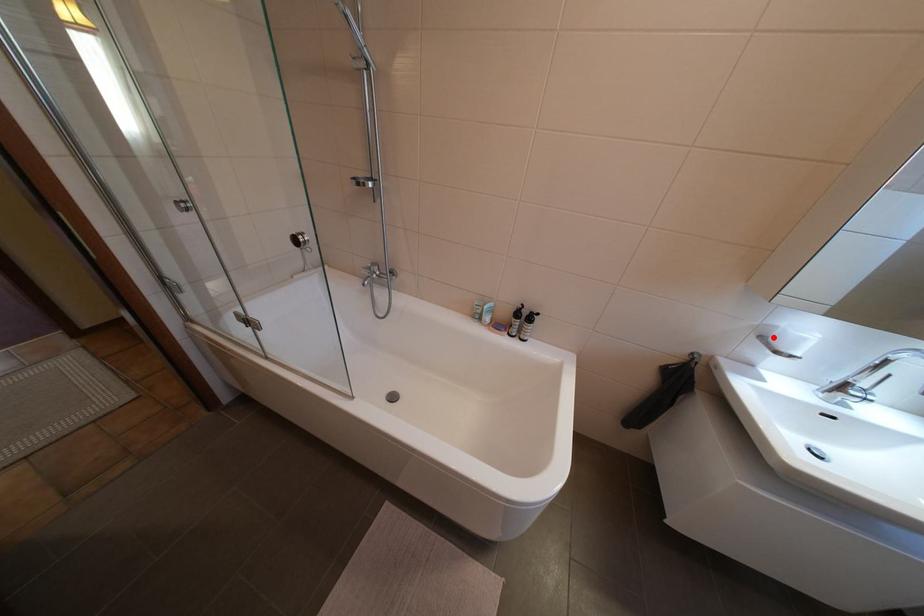
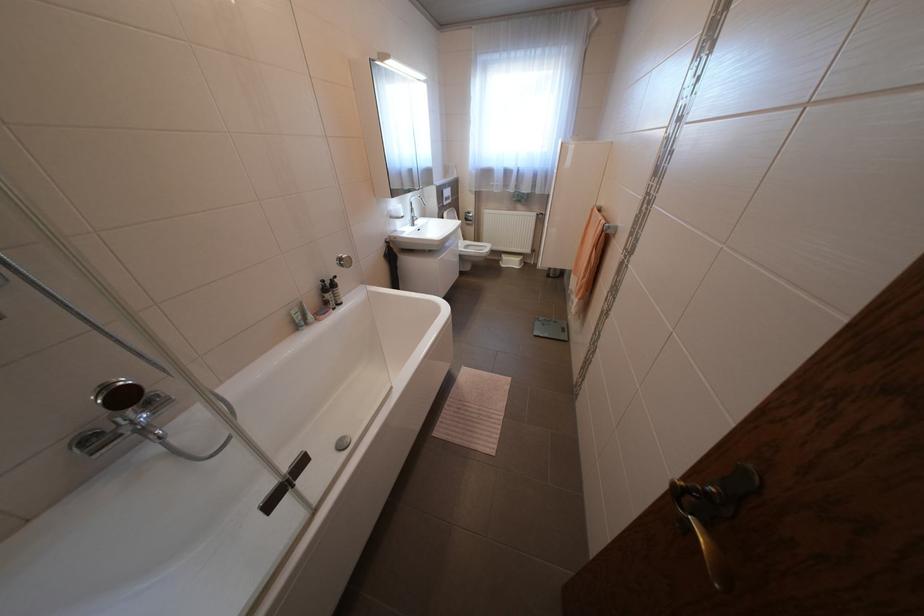
Question: I am providing you with two images of the same scene from different viewpoints. In image1, a red point is highlighted. Considering the same 3D point in image2, which of the following is correct?

Choices:
 (A) It is closer
 (B) It is farther

Answer: (A)